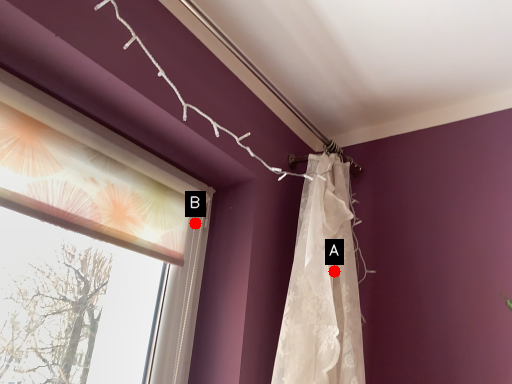
Question: Two points are circled on the image, labeled by A and B beside each circle. Among these points, which one is nearest to the camera?

Choices:
 (A) A is closer
 (B) B is closer

Answer: (A)